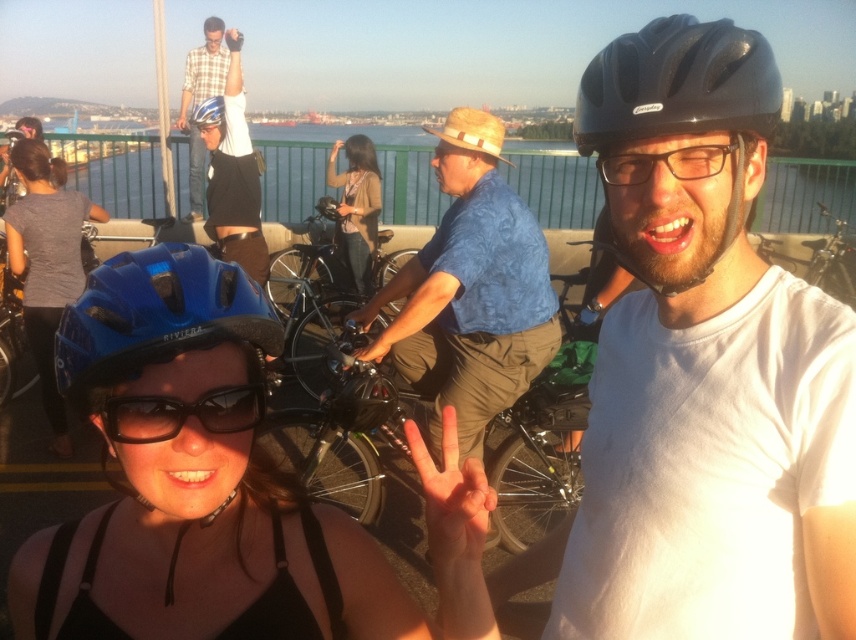
What do you see at coordinates (158, 314) in the screenshot? I see `blue matte helmet at lower left` at bounding box center [158, 314].

Does blue matte helmet at lower left have a greater width compared to matte blue helmet at upper center?

In fact, blue matte helmet at lower left might be narrower than matte blue helmet at upper center.

Where is `blue matte helmet at lower left`? blue matte helmet at lower left is located at coordinates (158, 314).

Is black matte helmet at upper right taller than black reflective sunglasses at lower left?

Yes.

Does black matte helmet at upper right appear over black reflective sunglasses at lower left?

Yes.

Is point (617, 97) more distant than point (113, 420)?

Yes.

Find the location of `black matte helmet at upper right`. black matte helmet at upper right is located at coordinates (676, 83).

Which of these two, blue matte helmet at center or matte blue helmet at upper left, stands shorter?

blue matte helmet at center

Does blue matte helmet at center appear under matte blue helmet at upper left?

Yes.

This screenshot has height=640, width=856. I want to click on blue matte helmet at center, so click(x=191, y=472).